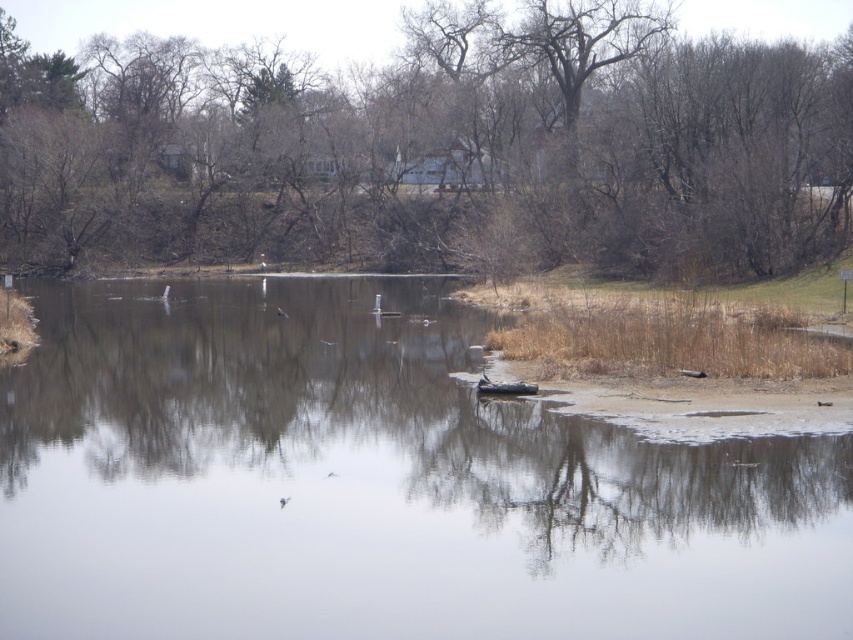
Which is in front, point (190, 314) or point (498, 392)?

Point (498, 392) is more forward.

Does transparent ice at center have a greater width compared to rubberized black boat at center?

Correct, the width of transparent ice at center exceeds that of rubberized black boat at center.

Measure the distance between transparent ice at center and camera.

10.82 meters

Find the location of `transparent ice at center`. transparent ice at center is located at coordinates (374, 483).

How much distance is there between brown leafless tree at center and rubberized black boat at center?

brown leafless tree at center and rubberized black boat at center are 52.74 meters apart.

Is brown leafless tree at center to the left of rubberized black boat at center from the viewer's perspective?

Correct, you'll find brown leafless tree at center to the left of rubberized black boat at center.

Is point (180, 163) positioned behind point (496, 390)?

Yes, point (180, 163) is behind point (496, 390).

This screenshot has height=640, width=853. I want to click on brown leafless tree at center, so click(x=436, y=148).

Identify the location of transparent ice at center. The height and width of the screenshot is (640, 853). (374, 483).

Does transparent ice at center appear on the right side of brown leafless tree at center?

Yes, transparent ice at center is to the right of brown leafless tree at center.

I want to click on transparent ice at center, so click(374, 483).